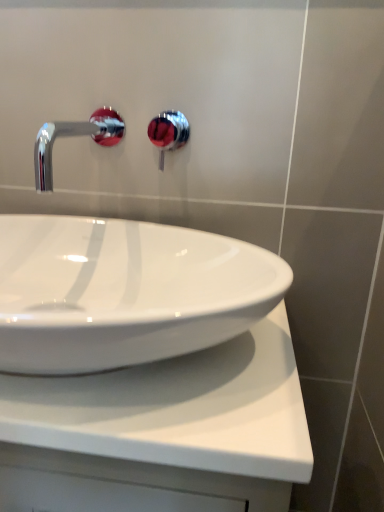
The image size is (384, 512). Describe the element at coordinates (168, 132) in the screenshot. I see `chrome/red faucet at upper center` at that location.

Where is `white glossy countertop at center`? This screenshot has height=512, width=384. white glossy countertop at center is located at coordinates [x=173, y=421].

Measure the distance between chrome/metallic faucet at upper left and white glossy countertop at center.

43.92 centimeters.

Does chrome/metallic faucet at upper left have a greater width compared to white glossy countertop at center?

No, chrome/metallic faucet at upper left is not wider than white glossy countertop at center.

Between chrome/metallic faucet at upper left and white glossy countertop at center, which one has larger size?

white glossy countertop at center.

Can you tell me how much chrome/metallic faucet at upper left and white glossy countertop at center differ in facing direction?

1.81 degrees.

Considering the sizes of objects white glossy countertop at center and chrome/metallic faucet at upper left in the image provided, who is bigger, white glossy countertop at center or chrome/metallic faucet at upper left?

white glossy countertop at center.

Which object is more forward, white glossy countertop at center or chrome/metallic faucet at upper left?

white glossy countertop at center is more forward.

From the image's perspective, between white glossy countertop at center and chrome/metallic faucet at upper left, which one is located above?

chrome/metallic faucet at upper left is shown above in the image.

In the image, there is a chrome/metallic faucet at upper left. Identify the location of counter top below it (from a real-world perspective). (173, 421).

From the picture: Is white glossy countertop at center not within chrome/red faucet at upper center?

Indeed, white glossy countertop at center is completely outside chrome/red faucet at upper center.

Which is behind, white glossy countertop at center or chrome/red faucet at upper center?

chrome/red faucet at upper center is further from the camera.

Identify the location of counter top below the chrome/red faucet at upper center (from a real-world perspective). (173, 421).

Is chrome/red faucet at upper center looking in the opposite direction of chrome/metallic faucet at upper left?

No, chrome/red faucet at upper center's orientation is not away from chrome/metallic faucet at upper left.

Are chrome/red faucet at upper center and chrome/metallic faucet at upper left far apart?

No, chrome/red faucet at upper center is not far from chrome/metallic faucet at upper left.

From a real-world perspective, between chrome/red faucet at upper center and chrome/metallic faucet at upper left, who is vertically higher?

In real-world perspective, chrome/metallic faucet at upper left is above.

In the scene shown: Can you tell me how much chrome/red faucet at upper center and chrome/metallic faucet at upper left differ in facing direction?

The angle between the facing direction of chrome/red faucet at upper center and the facing direction of chrome/metallic faucet at upper left is 0.013 degrees.

Is chrome/metallic faucet at upper left smaller than chrome/red faucet at upper center?

No, chrome/metallic faucet at upper left is not smaller than chrome/red faucet at upper center.

Which is more to the left, chrome/metallic faucet at upper left or chrome/red faucet at upper center?

chrome/metallic faucet at upper left is more to the left.

Considering the sizes of chrome/metallic faucet at upper left and chrome/red faucet at upper center in the image, is chrome/metallic faucet at upper left taller or shorter than chrome/red faucet at upper center?

chrome/metallic faucet at upper left is shorter than chrome/red faucet at upper center.

In terms of width, does chrome/metallic faucet at upper left look wider or thinner when compared to chrome/red faucet at upper center?

In the image, chrome/metallic faucet at upper left appears to be wider than chrome/red faucet at upper center.

Is chrome/red faucet at upper center outside of white glossy countertop at center?

Yes, chrome/red faucet at upper center is not within white glossy countertop at center.

What's the angular difference between chrome/red faucet at upper center and white glossy countertop at center's facing directions?

The angle between the facing direction of chrome/red faucet at upper center and the facing direction of white glossy countertop at center is 1.81 degrees.

From the image's perspective, between chrome/red faucet at upper center and white glossy countertop at center, who is located below?

white glossy countertop at center.

Image resolution: width=384 pixels, height=512 pixels. What are the coordinates of `counter top below the chrome/metallic faucet at upper left (from a real-world perspective)` in the screenshot? It's located at point(173,421).

Locate an element on the screen. The image size is (384, 512). tap positioned vertically above the white glossy countertop at center (from a real-world perspective) is located at coordinates (73, 135).

From the image, which object appears to be nearer to chrome/red faucet at upper center, chrome/metallic faucet at upper left or white glossy countertop at center?

chrome/metallic faucet at upper left lies closer to chrome/red faucet at upper center than the other object.

Considering their positions, is white glossy countertop at center positioned further to chrome/red faucet at upper center than chrome/metallic faucet at upper left?

white glossy countertop at center.

From the image, which object appears to be nearer to chrome/metallic faucet at upper left, white glossy countertop at center or chrome/red faucet at upper center?

white glossy countertop at center is positioned closer to the anchor chrome/metallic faucet at upper left.

When comparing their distances from white glossy countertop at center, does chrome/red faucet at upper center or chrome/metallic faucet at upper left seem further?

The object further to white glossy countertop at center is chrome/red faucet at upper center.

From the image, which object appears to be nearer to white glossy countertop at center, chrome/metallic faucet at upper left or chrome/red faucet at upper center?

chrome/metallic faucet at upper left is positioned closer to the anchor white glossy countertop at center.

When comparing their distances from chrome/metallic faucet at upper left, does chrome/red faucet at upper center or white glossy countertop at center seem further?

chrome/red faucet at upper center.

Locate an element on the screen. This screenshot has width=384, height=512. tap between chrome/red faucet at upper center and white glossy countertop at center vertically is located at coordinates 73,135.